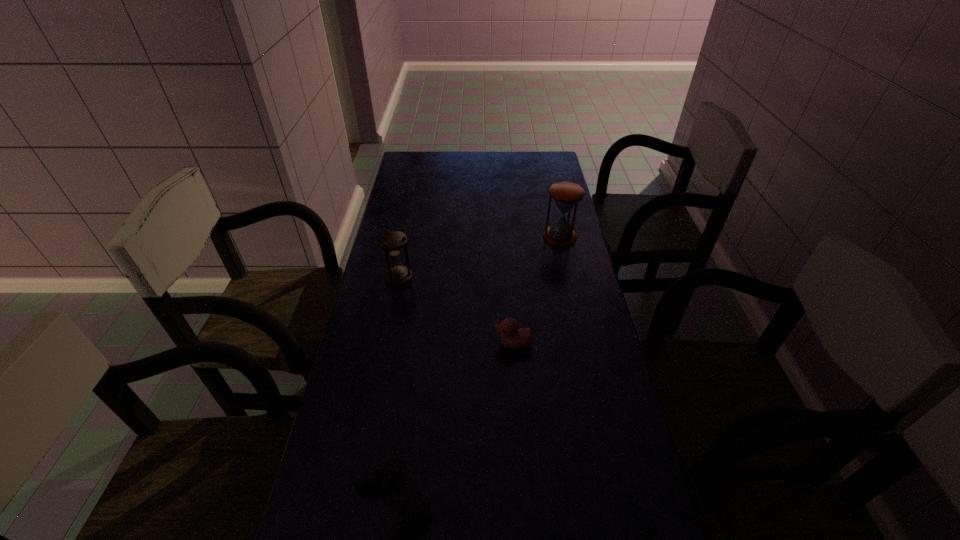
Find the location of `vacant area between the left hourglass and the farthest object`. vacant area between the left hourglass and the farthest object is located at coordinates (480, 258).

Locate an element on the screen. The width and height of the screenshot is (960, 540). free space that is in between the nearer hourglass and the third object from left to right is located at coordinates (456, 311).

Locate an element on the screen. free spot between the second nearest object and the rightmost object is located at coordinates (537, 291).

This screenshot has width=960, height=540. I want to click on free area in between the second farthest object and the third object from left to right, so click(x=456, y=311).

Locate an element on the screen. vacant point located between the left hourglass and the third tallest object is located at coordinates (456, 311).

Where is `free point between the rightmost object and the second object from right to left`? free point between the rightmost object and the second object from right to left is located at coordinates (537, 291).

Identify the location of object that is the closest to the second shortest object. (392, 242).

Choose which object is the third nearest neighbor to the left hourglass. Please provide its 2D coordinates. Your answer should be formatted as a tuple, i.e. [(x, y)], where the tuple contains the x and y coordinates of a point satisfying the conditions above.

[(391, 474)]

This screenshot has width=960, height=540. In order to click on free spot that satisfies the following two spatial constraints: 1. on the back side of the rightmost object; 2. on the right side of the nearer hourglass in this screenshot , I will do `click(407, 237)`.